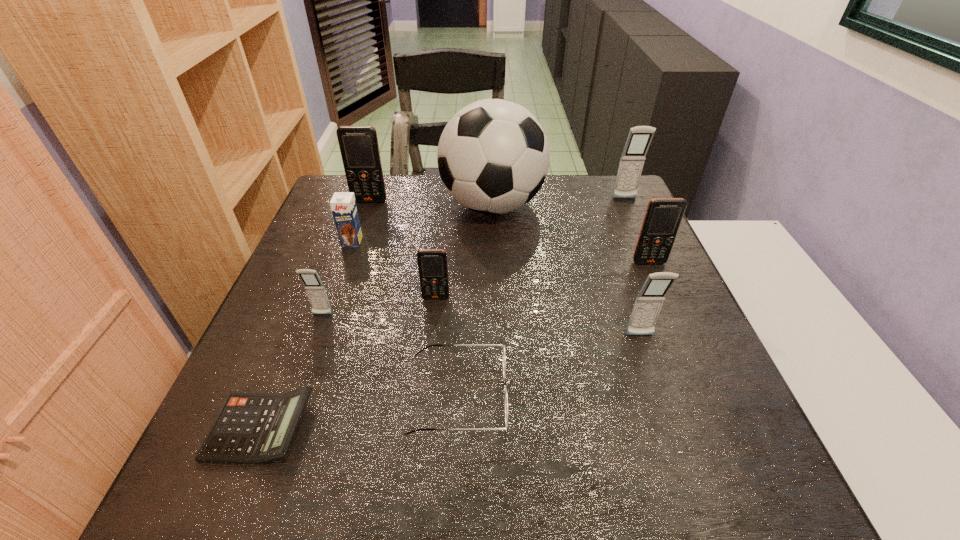
Locate an element on the screen. black soccer ball is located at coordinates (493, 155).

I want to click on the tallest object, so click(493, 155).

You are a GUI agent. You are given a task and a screenshot of the screen. Output one action in this format:
    pyautogui.click(x=<x>, y=<y>)
    Task: Click on the farthest gray cellular telephone
    
    Given the screenshot: What is the action you would take?
    pyautogui.click(x=632, y=160)

You are a GUI agent. You are given a task and a screenshot of the screen. Output one action in this format:
    pyautogui.click(x=<x>, y=<y>)
    Task: Click on the biggest gray cellular telephone
    This screenshot has width=960, height=540.
    Given the screenshot: What is the action you would take?
    pyautogui.click(x=632, y=160)

Where is `the leftmost orange cellular telephone`? The width and height of the screenshot is (960, 540). the leftmost orange cellular telephone is located at coordinates (359, 148).

Identify the location of the biggest orange cellular telephone. (359, 148).

Locate an element on the screen. The width and height of the screenshot is (960, 540). the eighth farthest object is located at coordinates (648, 303).

The width and height of the screenshot is (960, 540). What are the coordinates of `the eighth object from left to right` in the screenshot? It's located at (648, 303).

Identify the location of the second smallest orange cellular telephone. (663, 216).

You are a GUI agent. You are given a task and a screenshot of the screen. Output one action in this format:
    pyautogui.click(x=<x>, y=<y>)
    Task: Click on the second farthest orange cellular telephone
    This screenshot has height=540, width=960.
    Given the screenshot: What is the action you would take?
    pyautogui.click(x=663, y=216)